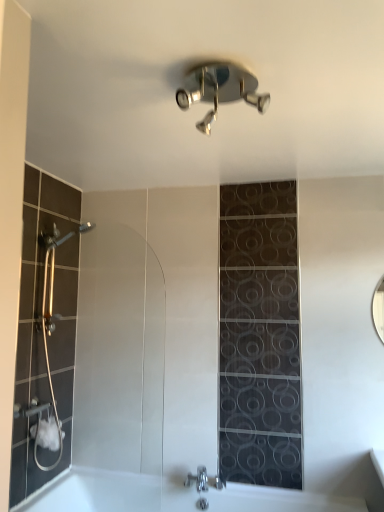
Question: From a real-world perspective, is chrome metallic faucet at lower center located higher than polished chrome shower at upper center?

Choices:
 (A) no
 (B) yes

Answer: (A)

Question: Is chrome metallic faucet at lower center oriented away from polished chrome shower at upper center?

Choices:
 (A) yes
 (B) no

Answer: (B)

Question: Considering the relative positions of chrome metallic faucet at lower center and polished chrome shower at upper center in the image provided, is chrome metallic faucet at lower center behind polished chrome shower at upper center?

Choices:
 (A) no
 (B) yes

Answer: (B)

Question: Considering the relative sizes of chrome metallic faucet at lower center and polished chrome shower at upper center in the image provided, is chrome metallic faucet at lower center wider than polished chrome shower at upper center?

Choices:
 (A) no
 (B) yes

Answer: (A)

Question: From a real-world perspective, is chrome metallic faucet at lower center beneath polished chrome shower at upper center?

Choices:
 (A) yes
 (B) no

Answer: (A)

Question: Based on their sizes in the image, would you say white glossy bathtub at lower center is bigger or smaller than chrome metallic faucet at lower center?

Choices:
 (A) small
 (B) big

Answer: (B)

Question: Considering their positions, is white glossy bathtub at lower center located in front of or behind chrome metallic faucet at lower center?

Choices:
 (A) front
 (B) behind

Answer: (A)

Question: Looking at their shapes, would you say white glossy bathtub at lower center is wider or thinner than chrome metallic faucet at lower center?

Choices:
 (A) thin
 (B) wide

Answer: (B)

Question: Considering the relative positions of white glossy bathtub at lower center and chrome metallic faucet at lower center in the image provided, is white glossy bathtub at lower center to the left or to the right of chrome metallic faucet at lower center?

Choices:
 (A) right
 (B) left

Answer: (B)

Question: Considering the positions of point (208, 502) and point (253, 490), is point (208, 502) closer or farther from the camera than point (253, 490)?

Choices:
 (A) farther
 (B) closer

Answer: (B)

Question: In terms of width, does chrome metallic faucet at lower center look wider or thinner when compared to white glossy bathtub at lower center?

Choices:
 (A) wide
 (B) thin

Answer: (B)

Question: Considering the positions of chrome metallic faucet at lower center and white glossy bathtub at lower center in the image, is chrome metallic faucet at lower center taller or shorter than white glossy bathtub at lower center?

Choices:
 (A) short
 (B) tall

Answer: (A)

Question: Considering the positions of chrome metallic faucet at lower center and white glossy bathtub at lower center in the image, is chrome metallic faucet at lower center bigger or smaller than white glossy bathtub at lower center?

Choices:
 (A) big
 (B) small

Answer: (B)

Question: Does point (235, 68) appear closer or farther from the camera than point (296, 509)?

Choices:
 (A) farther
 (B) closer

Answer: (B)

Question: Considering the relative positions of polished chrome shower at upper center and white glossy bathtub at lower center in the image provided, is polished chrome shower at upper center to the left or to the right of white glossy bathtub at lower center?

Choices:
 (A) left
 (B) right

Answer: (B)